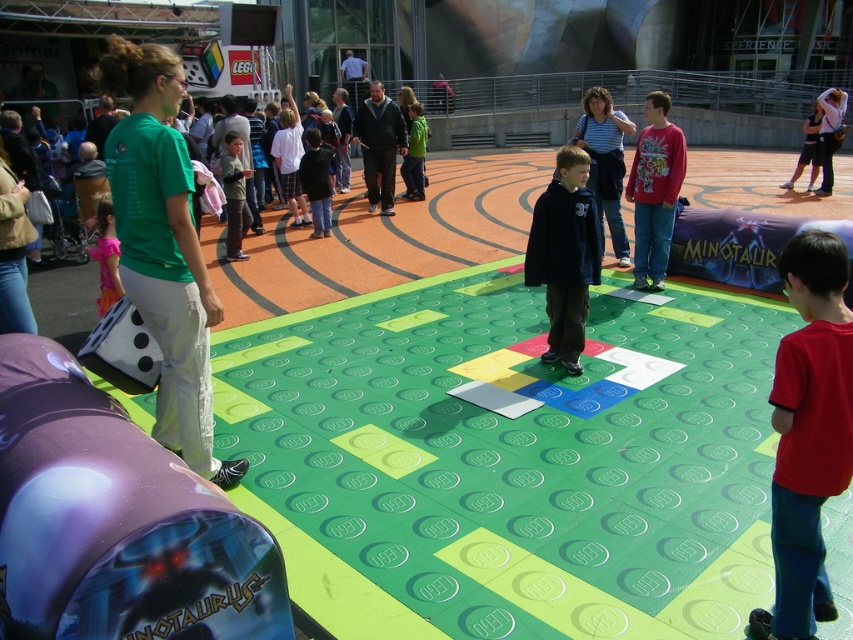
You are a photographer at the LEGO event. You need to arrange the striped cotton shirt at center and the floral chiffon dress at lower left in a photo so that both are fully visible. Which object should be placed closer to the camera to ensure the other doesn

The striped cotton shirt at center has a lesser height compared to floral chiffon dress at lower left. To ensure both are fully visible, the striped cotton shirt at center should be placed closer to the camera so its smaller size doesn

Based on the photo, you are standing in the LEGO event area and want to walk from point (590,88) to point (111,216). Which direction should you move relative to your current position?

You should move downward and to the right because point (111,216) is located lower and further to the right compared to point (590,88).